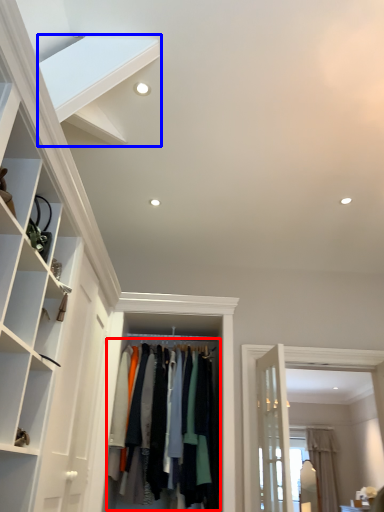
Question: Which point is further to the camera, clothing (highlighted by a red box) or stairs (highlighted by a blue box)?

Choices:
 (A) clothing
 (B) stairs

Answer: (A)